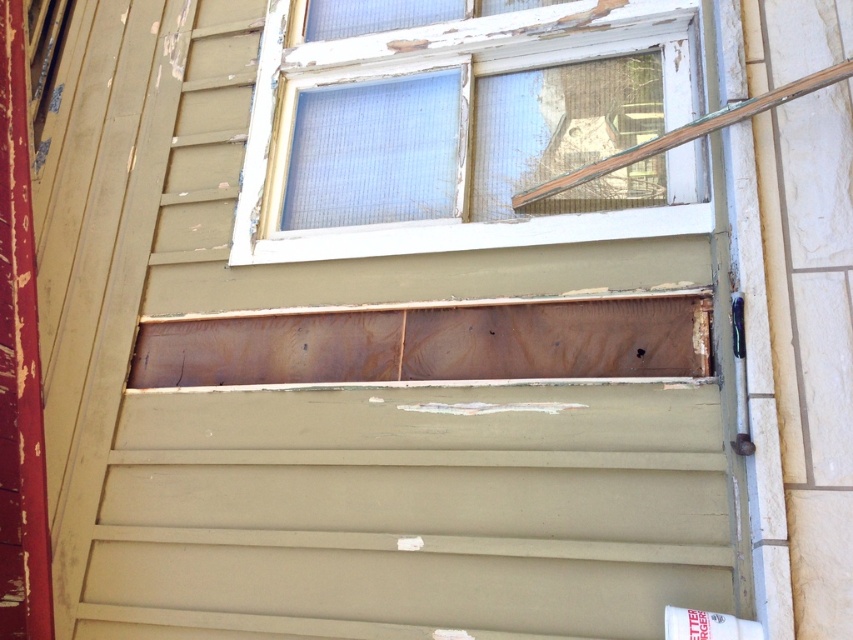
You are standing in front of the building and notice the white wood window frame at upper center and the wooden at upper right. Which object is positioned to the left of the other?

The white wood window frame at upper center is positioned to the left of the wooden at upper right.